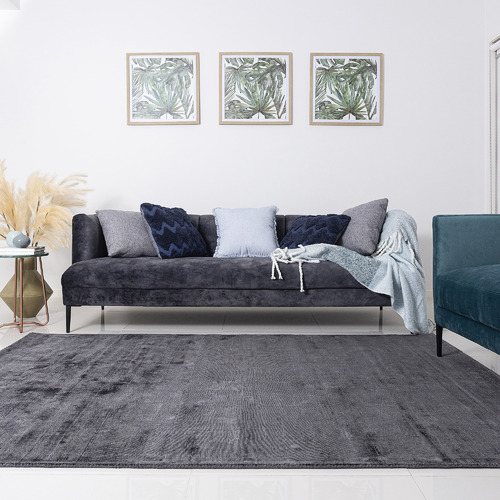
You are a GUI agent. You are given a task and a screenshot of the screen. Output one action in this format:
    pyautogui.click(x=<x>, y=<y>)
    Task: Click on the pillow
    
    Given the screenshot: What is the action you would take?
    179,235